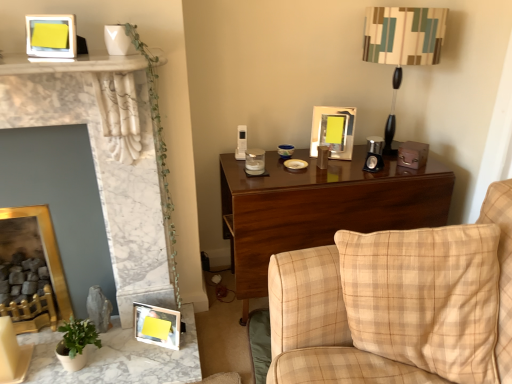
Question: Do you think yellow matte picture frame at upper left, which is the second picture frame in left-to-right order, is within white marble fireplace at left, or outside of it?

Choices:
 (A) outside
 (B) inside

Answer: (A)

Question: Considering the positions of yellow matte picture frame at upper left, which ranks as the 4th picture frame in bottom-to-top order, and white marble fireplace at left in the image, is yellow matte picture frame at upper left, which ranks as the 4th picture frame in bottom-to-top order, bigger or smaller than white marble fireplace at left?

Choices:
 (A) small
 (B) big

Answer: (A)

Question: Which of these objects is positioned closest to the beige plaid fabric couch at right?

Choices:
 (A) wooden photo frame at lower left, arranged as the first picture frame when ordered from the bottom
 (B) green leafy plant at upper left
 (C) green matte plant at lower left
 (D) yellow matte picture frame at upper left, which ranks as the 4th picture frame in bottom-to-top order
 (E) dark wood desk at center

Answer: (E)

Question: Which of these objects is positioned farthest from the dark wood desk at center?

Choices:
 (A) yellow matte picture frame at upper left, placed as the third picture frame when sorted from right to left
 (B) metallic silver picture frame at upper center, the 2th picture frame positioned from the top
 (C) gold/gilded picture frame at lower left, the 3th picture frame positioned from the top
 (D) white marble fireplace at left
 (E) green leafy plant at upper left

Answer: (A)